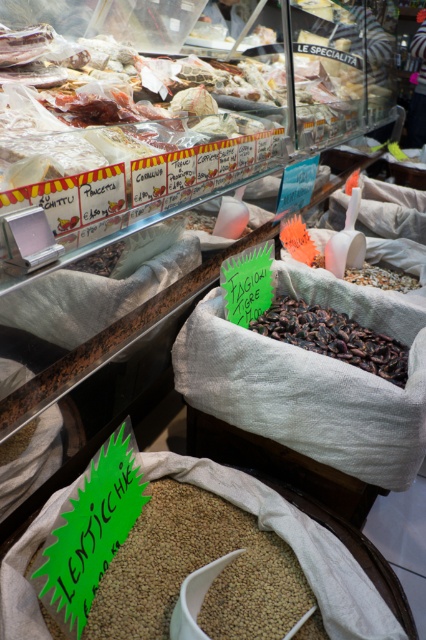
Is brown matte lentils at center to the right of dark brown grain at center from the viewer's perspective?

In fact, brown matte lentils at center is to the left of dark brown grain at center.

Does point (244, 632) come farther from viewer compared to point (380, 348)?

No, it is in front of (380, 348).

Locate an element on the screen. Image resolution: width=426 pixels, height=640 pixels. brown matte lentils at center is located at coordinates (195, 570).